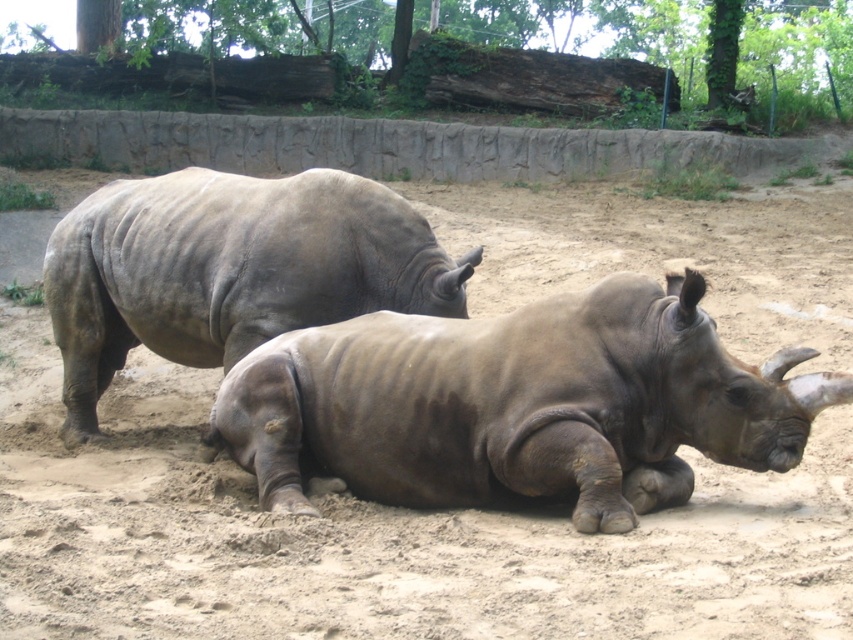
You are a zookeeper who needs to separate the two rhinos using a divider that is 36 inches wide. The divider can only be placed between the matte gray rhino at lower center and the gray matte rhinoceros at center. Will the divider fit between them?

The distance between the matte gray rhino at lower center and the gray matte rhinoceros at center is 36.51 inches. Since the divider is 36 inches wide, it will fit between them as the space is slightly larger than the divider.

Based on the photo, you are a zookeeper standing at the entrance of the rhinoceros enclosure. You notice two points in the enclosure marked as point 1 and point 2. Point 1 is at coordinate [776,372] and point 2 is at coordinate [172,312]. Which point is closer to you?

Point 1 is closer to the viewer than point 2.